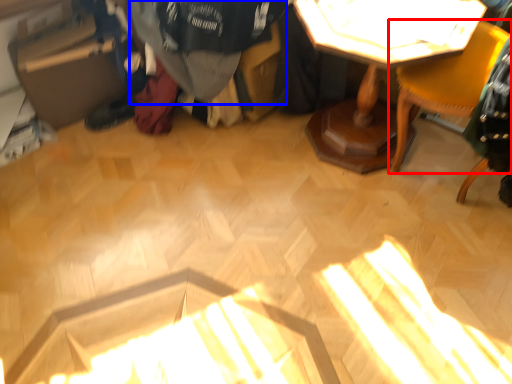
Question: Which object appears farthest to the camera in this image, chair (highlighted by a red box) or clothing (highlighted by a blue box)?

Choices:
 (A) chair
 (B) clothing

Answer: (B)